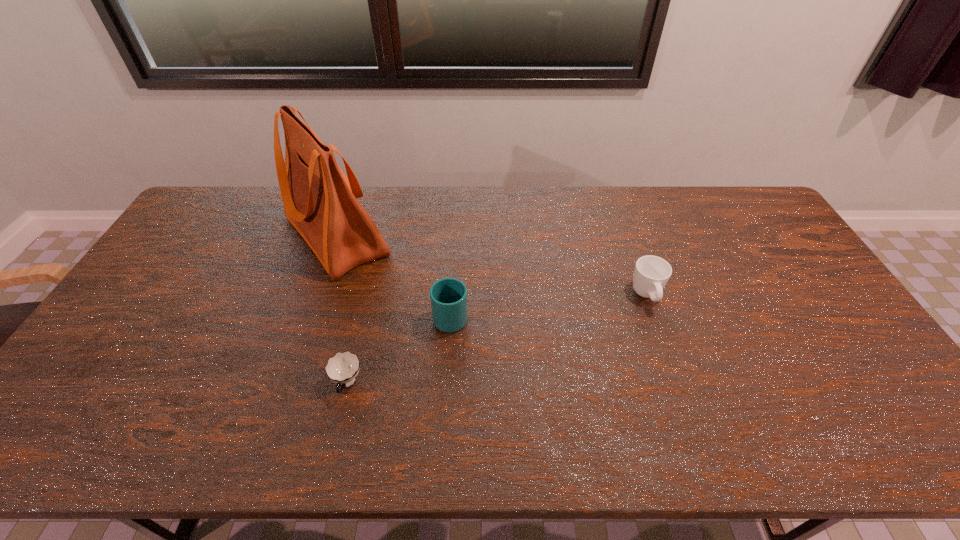
I want to click on free point between the third tallest object and the tallest object, so click(492, 266).

This screenshot has height=540, width=960. What are the coordinates of `free space between the second shortest cup and the second object from right to left` in the screenshot? It's located at (548, 306).

The width and height of the screenshot is (960, 540). In order to click on vacant space in between the tallest cup and the second shortest cup in this screenshot , I will do `click(548, 306)`.

At what (x,y) coordinates should I click in order to perform the action: click on unoccupied position between the rightmost cup and the tallest object. Please return your answer as a coordinate pair (x, y). The width and height of the screenshot is (960, 540). Looking at the image, I should click on (492, 266).

You are a GUI agent. You are given a task and a screenshot of the screen. Output one action in this format:
    pyautogui.click(x=<x>, y=<y>)
    Task: Click on the free point between the second shortest object and the shortest object
    
    Given the screenshot: What is the action you would take?
    pyautogui.click(x=497, y=340)

Image resolution: width=960 pixels, height=540 pixels. I want to click on free space between the second cup from left to right and the nearest object, so click(x=399, y=350).

The image size is (960, 540). Identify the location of free space between the shopping bag and the second tallest object. (394, 276).

Where is `empty location between the third object from left to right and the tallest object`? The width and height of the screenshot is (960, 540). empty location between the third object from left to right and the tallest object is located at coordinates (394, 276).

Identify the location of the second closest object relative to the second cup from left to right. The height and width of the screenshot is (540, 960). (342, 368).

Select which object appears as the third closest to the second tallest cup. Please provide its 2D coordinates. Your answer should be formatted as a tuple, i.e. [(x, y)], where the tuple contains the x and y coordinates of a point satisfying the conditions above.

[(342, 368)]